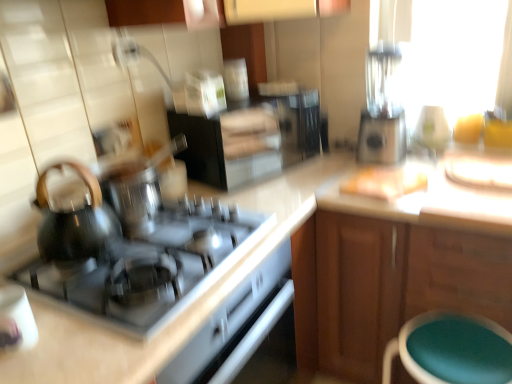
I want to click on sleek silver blender at upper right, so tap(382, 108).

Locate an element on the screen. The width and height of the screenshot is (512, 384). shiny black kettle at left is located at coordinates (75, 221).

What is the approximate height of wooden cabinet at right?

wooden cabinet at right is 32.92 inches in height.

The width and height of the screenshot is (512, 384). In order to click on teal fabric stool at lower right in this screenshot , I will do `click(452, 349)`.

Locate an element on the screen. This screenshot has width=512, height=384. shiny black cooktop at center-left is located at coordinates (150, 266).

Between shiny black cooktop at center-left and shiny black kettle at left, which one has smaller width?

Thinner between the two is shiny black kettle at left.

Does shiny black cooktop at center-left have a larger size compared to shiny black kettle at left?

Indeed, shiny black cooktop at center-left has a larger size compared to shiny black kettle at left.

Is shiny black cooktop at center-left positioned with its back to shiny black kettle at left?

No, shiny black cooktop at center-left is not facing away from shiny black kettle at left.

The image size is (512, 384). In order to click on gas stove below the shiny black kettle at left (from a real-world perspective) in this screenshot , I will do `click(150, 266)`.

Which is less distant, (298, 340) or (59, 166)?

Clearly, point (298, 340) is more distant from the camera than point (59, 166).

Is the depth of wooden cabinet at right greater than that of shiny black kettle at left?

Yes.

Is wooden cabinet at right touching shiny black kettle at left?

They are not placed beside each other.

Does shiny black kettle at left turn towards shiny black cooktop at center-left?

No.

How different are the orientations of shiny black kettle at left and shiny black cooktop at center-left in degrees?

3.09e-05 degrees.

Between shiny black kettle at left and shiny black cooktop at center-left, which one has less height?

With less height is shiny black cooktop at center-left.

Locate an element on the screen. This screenshot has height=384, width=512. gas stove on the right of shiny black kettle at left is located at coordinates (150, 266).

Identify the location of blender behind the shiny black kettle at left. This screenshot has width=512, height=384. (382, 108).

Can you confirm if shiny black kettle at left is taller than sleek silver blender at upper right?

No, shiny black kettle at left is not taller than sleek silver blender at upper right.

Is shiny black kettle at left surrounding sleek silver blender at upper right?

Actually, sleek silver blender at upper right is outside shiny black kettle at left.

Which point is more distant from viewer, (x=53, y=224) or (x=380, y=161)?

The point (x=380, y=161) is behind.

Between teal fabric stool at lower right and shiny black kettle at left, which one is positioned in front?

shiny black kettle at left is closer to the camera.

You are a GUI agent. You are given a task and a screenshot of the screen. Output one action in this format:
    pyautogui.click(x=<x>, y=<y>)
    Task: Click on the kitchen appliance lying on the left of teal fabric stool at lower right
    Image resolution: width=512 pixels, height=384 pixels.
    Given the screenshot: What is the action you would take?
    pos(75,221)

Is teal fabric stool at lower right bigger than shiny black kettle at left?

Indeed, teal fabric stool at lower right has a larger size compared to shiny black kettle at left.

Is teal fabric stool at lower right positioned with its back to shiny black kettle at left?

teal fabric stool at lower right does not have its back to shiny black kettle at left.

Would you say shiny black cooktop at center-left is inside or outside wooden cabinet at right?

shiny black cooktop at center-left is located beyond the bounds of wooden cabinet at right.

Which is farther, (110,312) or (503,325)?

Point (503,325)

Who is smaller, shiny black cooktop at center-left or wooden cabinet at right?

shiny black cooktop at center-left.

Between sleek silver blender at upper right and teal fabric stool at lower right, which one appears on the right side from the viewer's perspective?

teal fabric stool at lower right is more to the right.

Can you tell me how much sleek silver blender at upper right and teal fabric stool at lower right differ in facing direction?

0.0428 degrees.

Between sleek silver blender at upper right and teal fabric stool at lower right, which one has larger width?

teal fabric stool at lower right is wider.

Is point (374, 87) positioned behind point (500, 366)?

Yes, it is.

Where is `gas stove in front of the shiny black kettle at left`? gas stove in front of the shiny black kettle at left is located at coordinates coord(150,266).

This screenshot has width=512, height=384. I want to click on cabinetry that appears on the right of shiny black kettle at left, so click(x=389, y=286).

Estimate the real-world distances between objects in this image. Which object is further from sleek silver blender at upper right, shiny black cooktop at center-left or shiny black kettle at left?

shiny black kettle at left.

When comparing their distances from wooden cabinet at right, does teal fabric stool at lower right or shiny black cooktop at center-left seem further?

shiny black cooktop at center-left.

Looking at the image, which one is located closer to wooden cabinet at right, shiny black kettle at left or sleek silver blender at upper right?

sleek silver blender at upper right is closer to wooden cabinet at right.

Based on their spatial positions, is wooden cabinet at right or sleek silver blender at upper right closer to teal fabric stool at lower right?

wooden cabinet at right is closer to teal fabric stool at lower right.

Looking at this image, looking at the image, which one is located further to shiny black cooktop at center-left, teal fabric stool at lower right or wooden cabinet at right?

teal fabric stool at lower right.

Consider the image. Considering their positions, is shiny black cooktop at center-left positioned closer to shiny black kettle at left than wooden cabinet at right?

shiny black cooktop at center-left lies closer to shiny black kettle at left than the other object.

Based on their spatial positions, is shiny black kettle at left or shiny black cooktop at center-left further from teal fabric stool at lower right?

shiny black kettle at left is positioned further to the anchor teal fabric stool at lower right.

Based on the photo, based on their spatial positions, is wooden cabinet at right or sleek silver blender at upper right further from shiny black cooktop at center-left?

sleek silver blender at upper right is positioned further to the anchor shiny black cooktop at center-left.

Identify the location of bar stool between shiny black cooktop at center-left and wooden cabinet at right from left to right. (452, 349).

This screenshot has width=512, height=384. I want to click on blender between shiny black kettle at left and teal fabric stool at lower right in the horizontal direction, so click(382, 108).

Locate an element on the screen. This screenshot has width=512, height=384. blender located between shiny black cooktop at center-left and teal fabric stool at lower right in the left-right direction is located at coordinates (382, 108).

Where is `bar stool between shiny black kettle at left and wooden cabinet at right`? The height and width of the screenshot is (384, 512). bar stool between shiny black kettle at left and wooden cabinet at right is located at coordinates (452, 349).